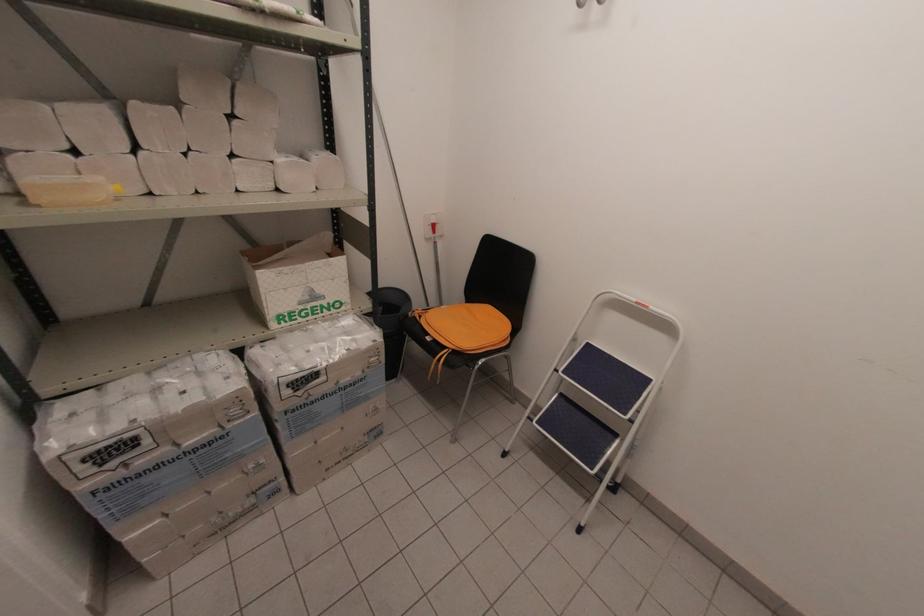
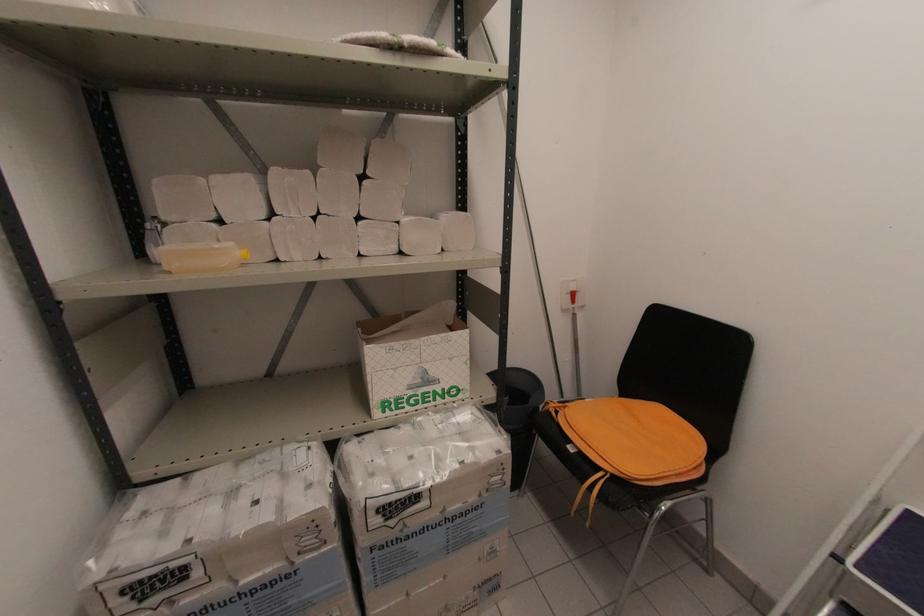
Question: Based on the continuous images, in which direction is the camera rotating? Reply with the corresponding letter.

Choices:
 (A) Left
 (B) Right
 (C) Up
 (D) Down

Answer: (A)